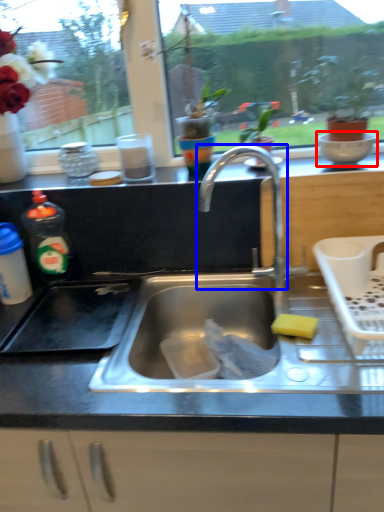
Question: Which object appears closest to the camera in this image, mixing bowl (highlighted by a red box) or tap (highlighted by a blue box)?

Choices:
 (A) mixing bowl
 (B) tap

Answer: (B)